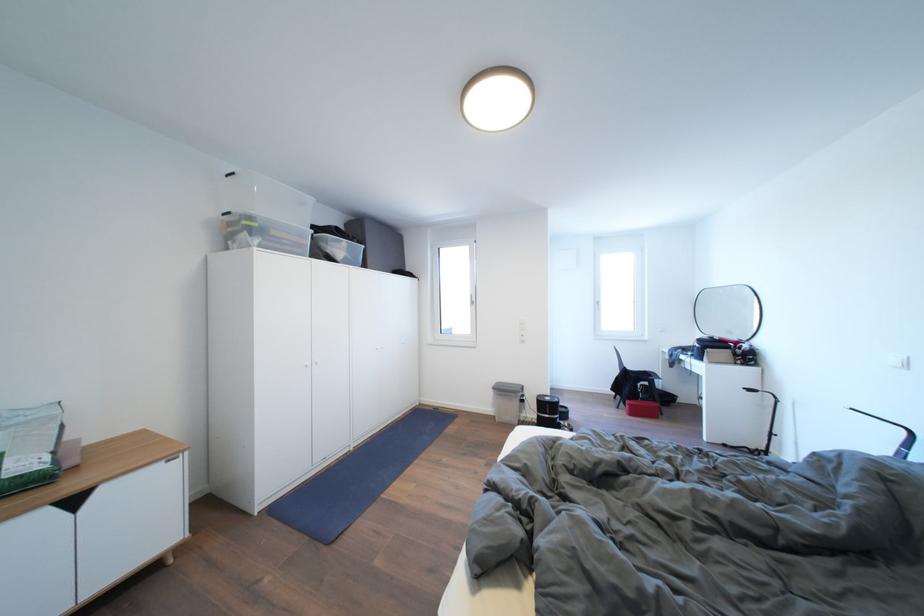
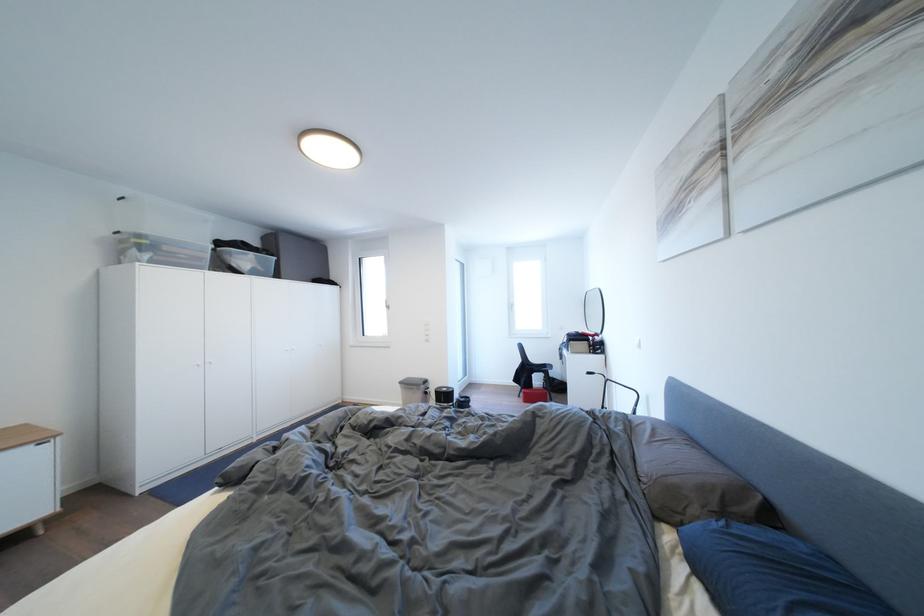
In a continuous first-person perspective shot, in which direction is the camera moving?

The cameraman moved toward right, backward.